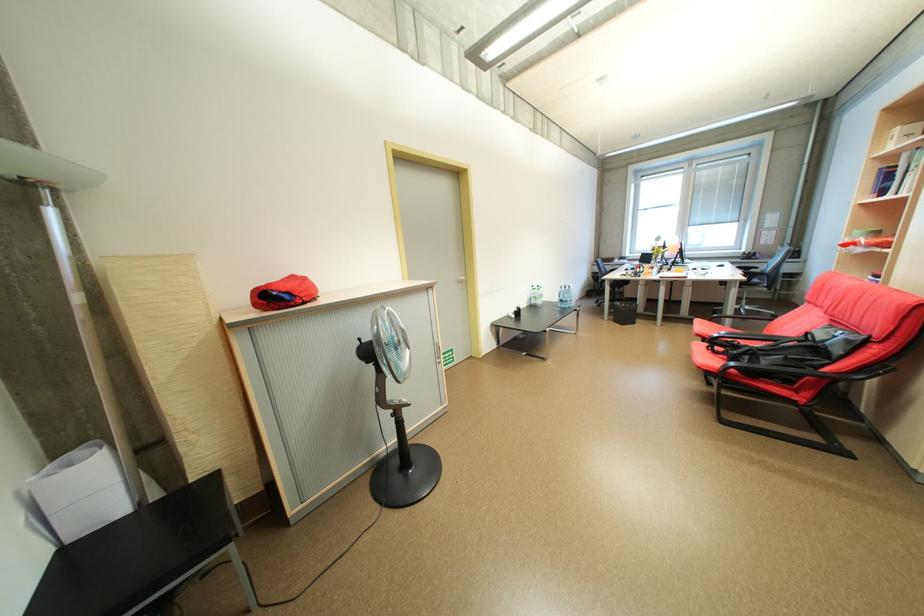
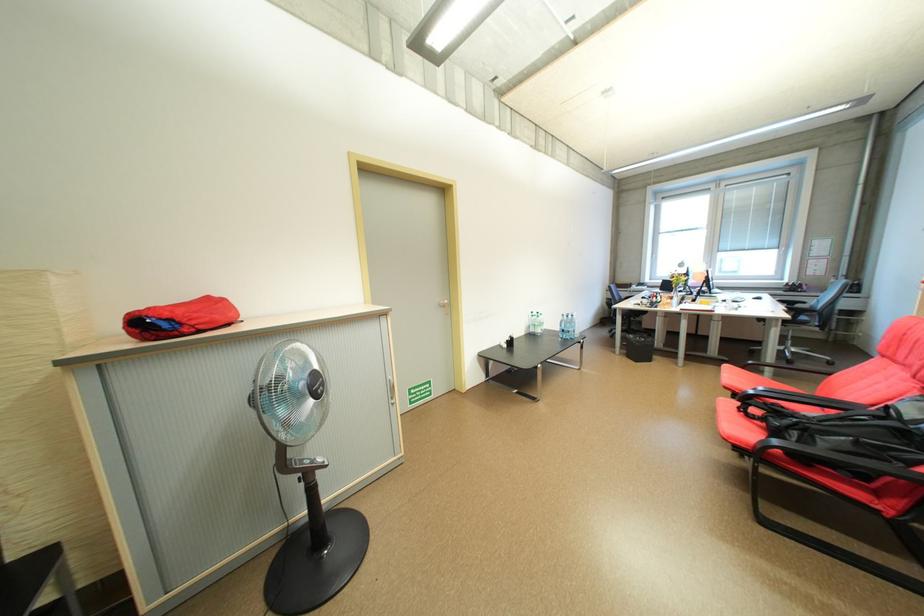
Locate, in the second image, the point that corresponds to (x=409, y=402) in the first image.

(322, 462)